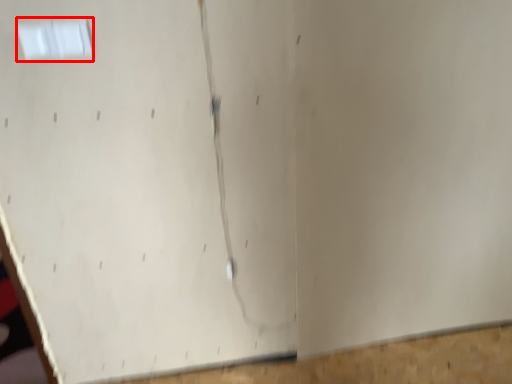
Question: Where is window (annotated by the red box) located in relation to plywood in the image?

Choices:
 (A) left
 (B) right

Answer: (A)